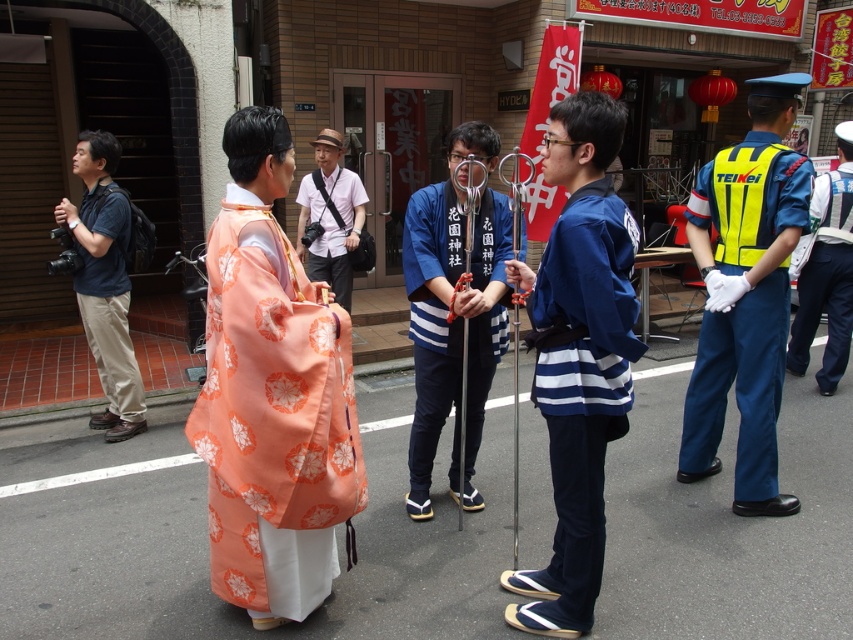
You are a tourist walking along the street and want to take a photo of both the blue fabric kimono at center and the yellow reflective vest at right. Which object should you focus on first to ensure both are in the frame?

You should focus on the blue fabric kimono at center first since it is closer to you than the yellow reflective vest at right, ensuring both are in the frame by adjusting the camera angle accordingly.

You are a photographer trying to capture both the blue cotton kimono at center and the dark blue shirt at left in a single frame. Which clothing item will appear larger in your photo?

The blue cotton kimono at center will appear larger in the photo because it is bigger than the dark blue shirt at left.